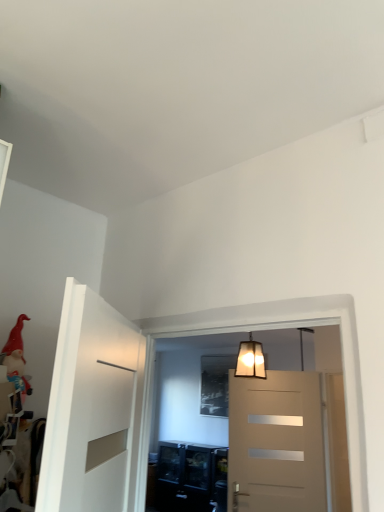
Question: From a real-world perspective, is red velvet santa hat at left positioned under translucent glass lampshade at upper center based on gravity?

Choices:
 (A) yes
 (B) no

Answer: (A)

Question: Is red velvet santa hat at left taller than translucent glass lampshade at upper center?

Choices:
 (A) yes
 (B) no

Answer: (B)

Question: Does red velvet santa hat at left have a smaller size compared to translucent glass lampshade at upper center?

Choices:
 (A) yes
 (B) no

Answer: (A)

Question: Is red velvet santa hat at left thinner than translucent glass lampshade at upper center?

Choices:
 (A) yes
 (B) no

Answer: (B)

Question: From a real-world perspective, is red velvet santa hat at left on top of translucent glass lampshade at upper center?

Choices:
 (A) no
 (B) yes

Answer: (A)

Question: Does red velvet santa hat at left lie in front of translucent glass lampshade at upper center?

Choices:
 (A) yes
 (B) no

Answer: (A)

Question: Does translucent glass lampshade at upper center come in front of red velvet santa hat at left?

Choices:
 (A) no
 (B) yes

Answer: (A)

Question: From a real-world perspective, is translucent glass lampshade at upper center on red velvet santa hat at left?

Choices:
 (A) no
 (B) yes

Answer: (B)

Question: Is the position of translucent glass lampshade at upper center more distant than that of red velvet santa hat at left?

Choices:
 (A) yes
 (B) no

Answer: (A)

Question: Is translucent glass lampshade at upper center far from red velvet santa hat at left?

Choices:
 (A) no
 (B) yes

Answer: (B)

Question: Could you tell me if translucent glass lampshade at upper center is turned towards red velvet santa hat at left?

Choices:
 (A) yes
 (B) no

Answer: (B)

Question: Is red velvet santa hat at left surrounded by translucent glass lampshade at upper center?

Choices:
 (A) yes
 (B) no

Answer: (B)

Question: Considering the positions of point (249, 339) and point (18, 332), is point (249, 339) closer or farther from the camera than point (18, 332)?

Choices:
 (A) closer
 (B) farther

Answer: (B)